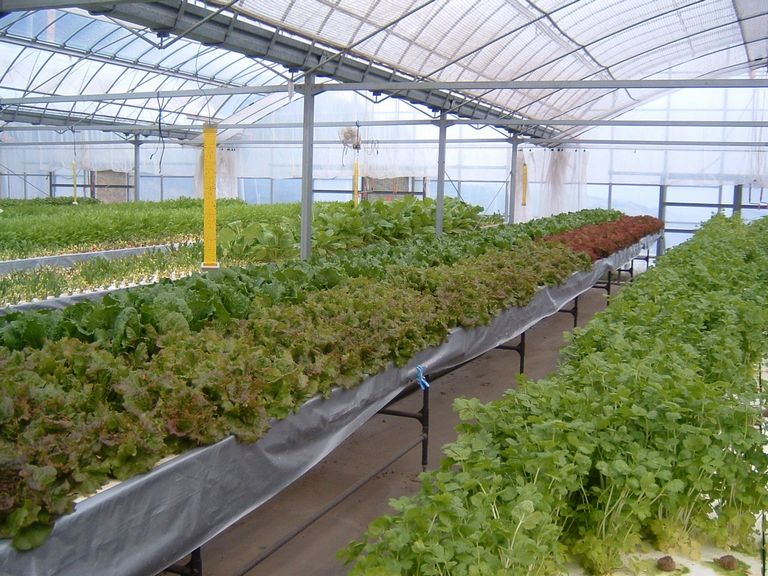
Where is `table legs`? table legs is located at coordinates (627, 271), (606, 288), (568, 314), (515, 348), (421, 416), (192, 560).